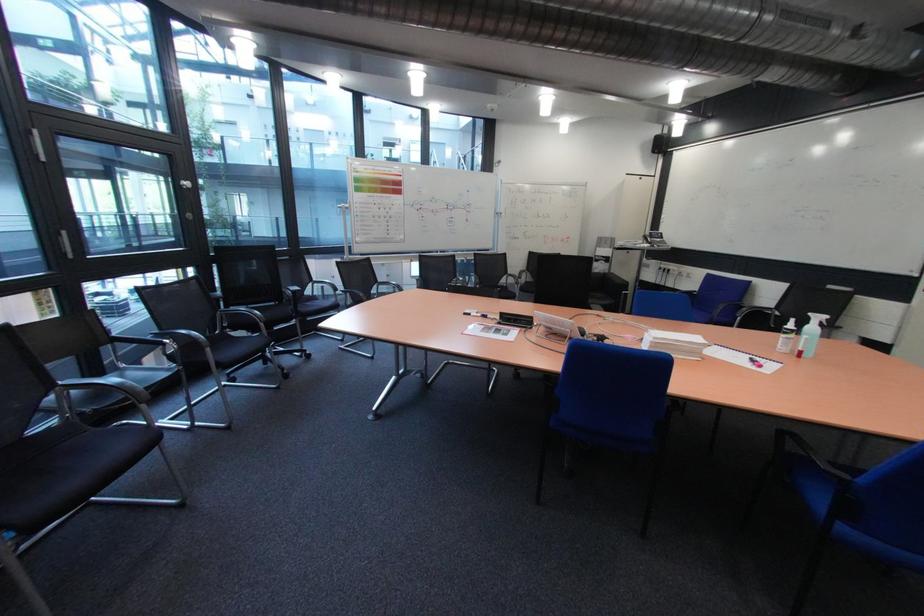
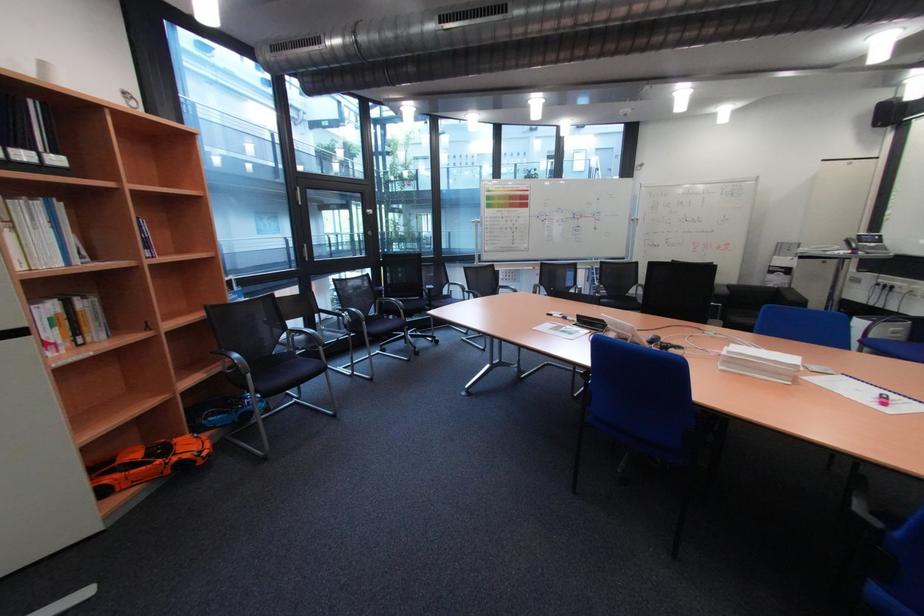
Question: The images are taken continuously from a first-person perspective. In which direction is your viewpoint rotating?

Choices:
 (A) Left
 (B) Right
 (C) Up
 (D) Down

Answer: (A)